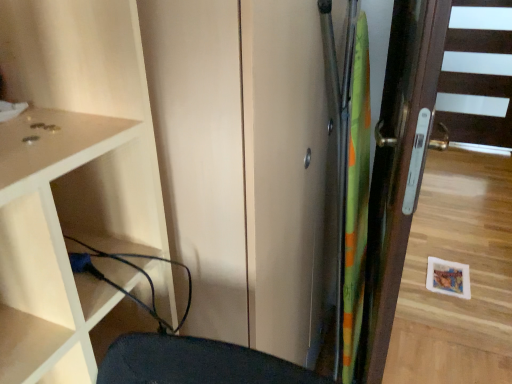
Question: Looking at the image, does green fabric screen door at right seem bigger or smaller compared to black rubber cable at lower left?

Choices:
 (A) big
 (B) small

Answer: (A)

Question: From the image's perspective, is green fabric screen door at right positioned above or below black rubber cable at lower left?

Choices:
 (A) below
 (B) above

Answer: (B)

Question: Which object is the farthest from the black rubber cable at lower left?

Choices:
 (A) green fabric screen door at right
 (B) matte white cupboard at left
 (C) brown wooden door at right

Answer: (C)

Question: Which is nearer to the matte white cupboard at left?

Choices:
 (A) black rubber cable at lower left
 (B) green fabric screen door at right
 (C) brown wooden door at right

Answer: (A)